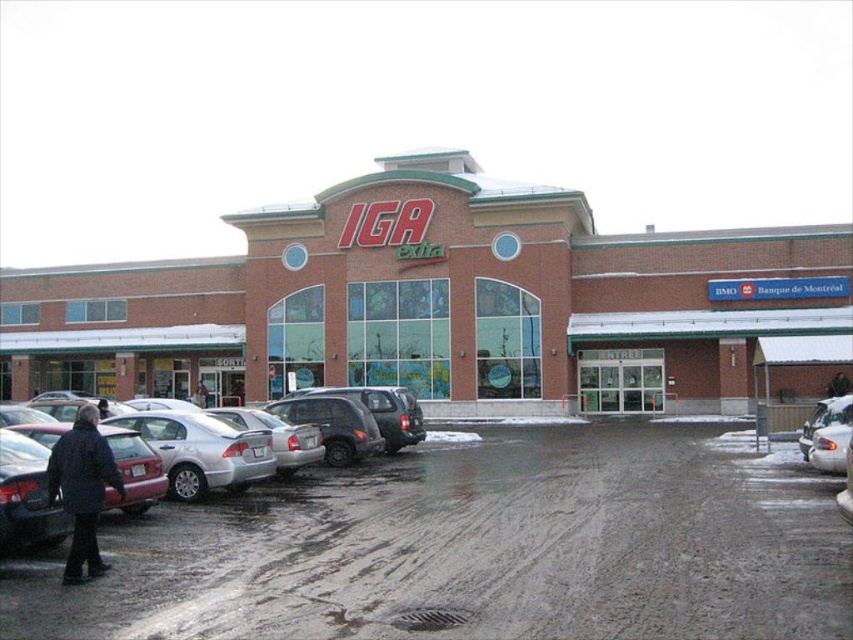
Question: Which point appears farthest from the camera in this image?

Choices:
 (A) (784, 472)
 (B) (57, 468)

Answer: (A)

Question: Does brown brick building at center have a smaller size compared to dark gray asphalt parking lot at lower center?

Choices:
 (A) no
 (B) yes

Answer: (A)

Question: Does brown brick building at center appear on the right side of dark gray asphalt parking lot at lower center?

Choices:
 (A) no
 (B) yes

Answer: (B)

Question: Which of the following is the closest to the observer?

Choices:
 (A) click(236, 408)
 (B) click(78, 493)
 (C) click(821, 365)

Answer: (B)

Question: Which object is positioned closest to the dark gray asphalt parking lot at lower center?

Choices:
 (A) brown brick building at center
 (B) dark blue jacket at lower left
 (C) silver metallic sedan at center-left

Answer: (C)

Question: Can you confirm if dark gray asphalt parking lot at lower center is smaller than dark blue jacket at lower left?

Choices:
 (A) yes
 (B) no

Answer: (B)